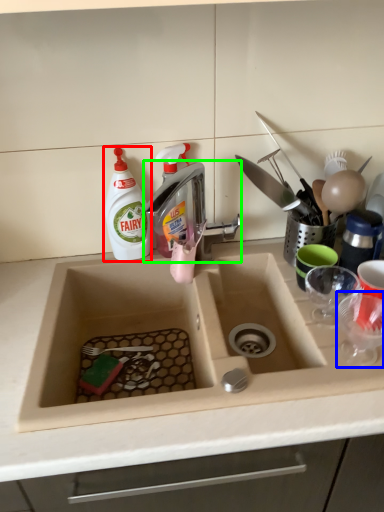
Question: Based on their relative distances, which object is farther from cleaning product (highlighted by a red box)? Choose from tableware (highlighted by a blue box) and tap (highlighted by a green box).

Choices:
 (A) tableware
 (B) tap

Answer: (A)